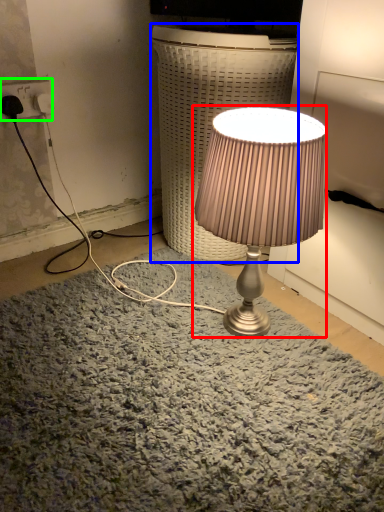
Question: Based on their relative distances, which object is nearer to lamp (highlighted by a red box)? Choose from table (highlighted by a blue box) and electric outlet (highlighted by a green box).

Choices:
 (A) table
 (B) electric outlet

Answer: (A)